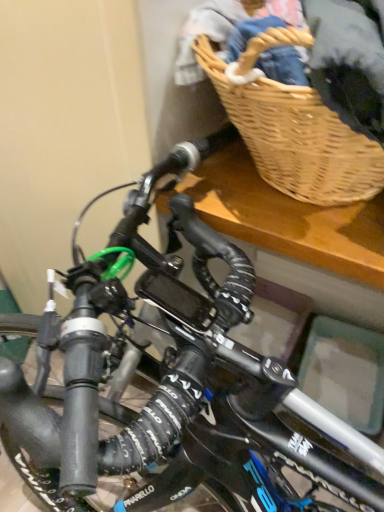
What do you see at coordinates (297, 138) in the screenshot? This screenshot has width=384, height=512. I see `woven wood picnic basket at upper right` at bounding box center [297, 138].

Measure the distance between woven wood picnic basket at upper right and camera.

They are 16.29 inches apart.

Identify the location of woven wood picnic basket at upper right. This screenshot has height=512, width=384. (297, 138).

Locate an element on the screen. woven wood picnic basket at upper right is located at coordinates (297, 138).